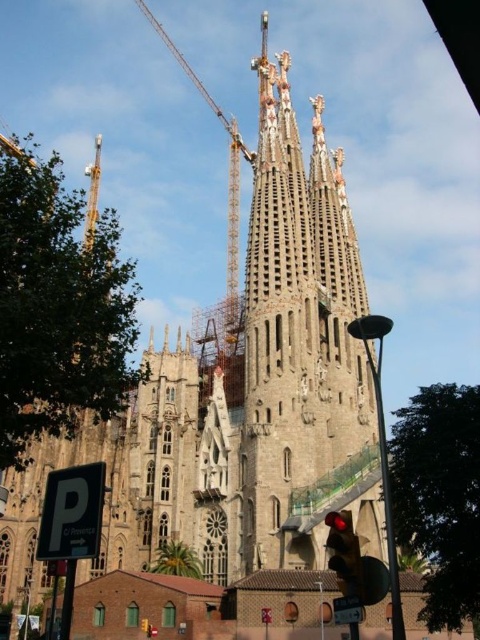
Between point (298, 324) and point (337, 561), which one is positioned in front?

Point (337, 561) is more forward.

Where is `gray stone tower at center`? The height and width of the screenshot is (640, 480). gray stone tower at center is located at coordinates (300, 340).

Who is lower down, metallic construction crane at upper center or red glass traffic light at lower center?

red glass traffic light at lower center is lower down.

Who is shorter, metallic construction crane at upper center or red glass traffic light at lower center?

red glass traffic light at lower center is shorter.

Does point (236, 132) lie in front of point (342, 588)?

No, it is behind (342, 588).

Find the location of `metallic construction crane at upper center`. metallic construction crane at upper center is located at coordinates (228, 189).

Which is more to the left, gray stone tower at center or metallic construction crane at upper center?

metallic construction crane at upper center is more to the left.

Can you confirm if gray stone tower at center is positioned to the left of metallic construction crane at upper center?

No, gray stone tower at center is not to the left of metallic construction crane at upper center.

Where is `gray stone tower at center`? The width and height of the screenshot is (480, 640). gray stone tower at center is located at coordinates (300, 340).